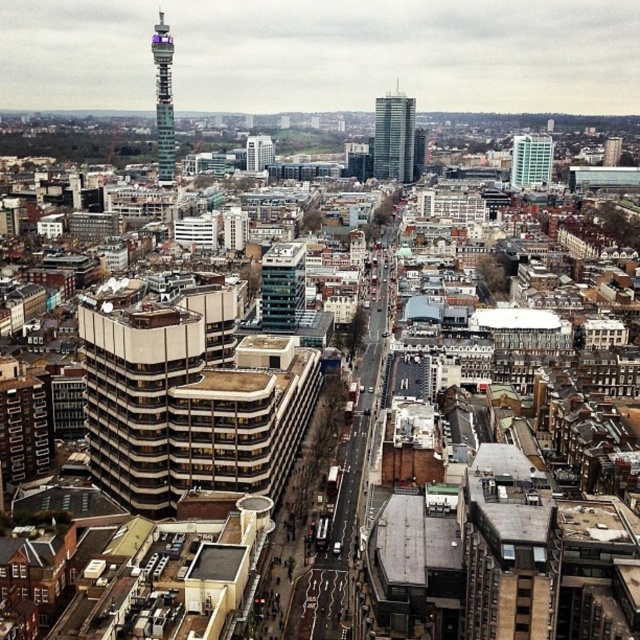
You are a drone operator tasked with capturing aerial footage of the city. Your drone has a maximum flight range of 1,500 feet. If you are currently positioned at the viewer location, can your drone safely reach the metallic glass tower at upper left without exceeding its range?

The metallic glass tower at upper left is 1669.21 feet away from the viewer. Since the drone has a maximum range of 1,500 feet, it cannot safely reach the tower without exceeding its operational limits.